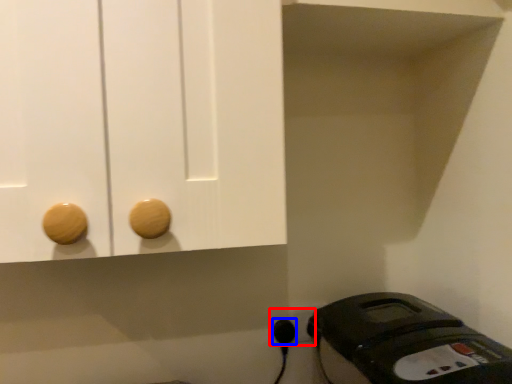
Question: Which object appears farthest to the camera in this image, electric outlet (highlighted by a red box) or plug (highlighted by a blue box)?

Choices:
 (A) electric outlet
 (B) plug

Answer: (A)